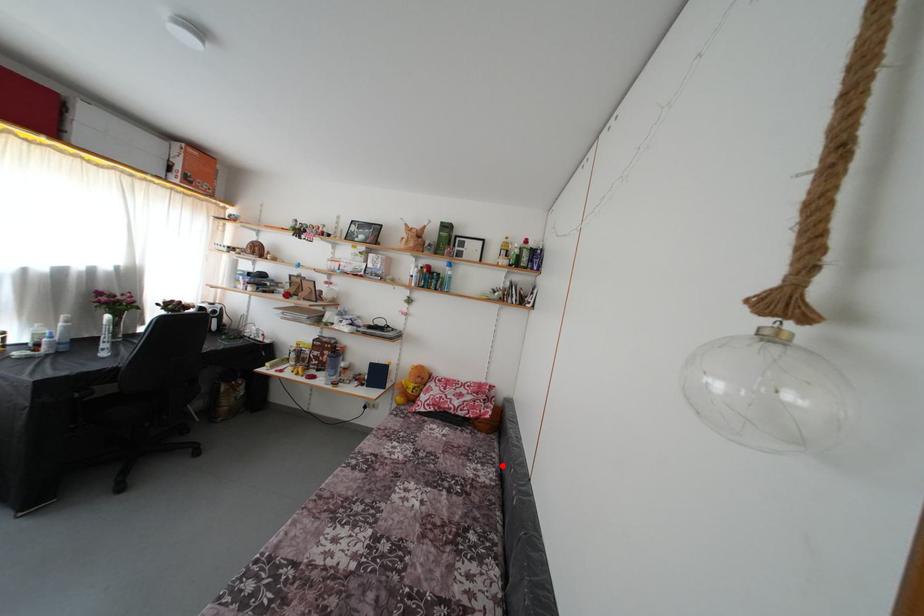
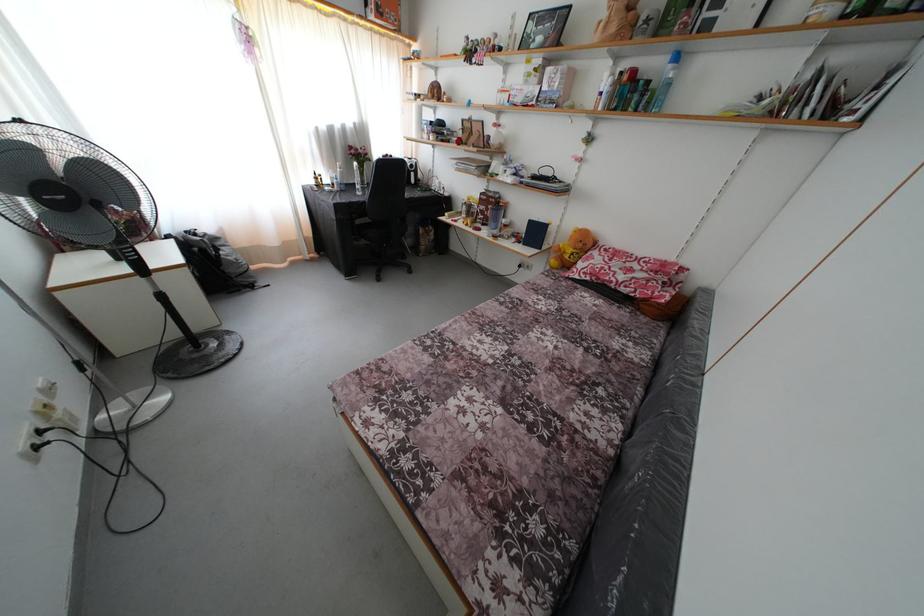
Where in the second image is the point corresponding to the highlighted location from the first image?

(663, 353)